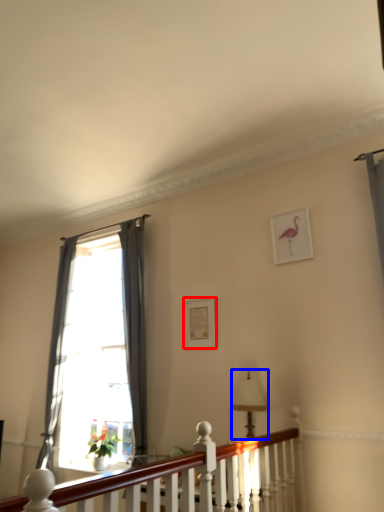
Question: Which object appears farthest to the camera in this image, picture frame (highlighted by a red box) or lamp (highlighted by a blue box)?

Choices:
 (A) picture frame
 (B) lamp

Answer: (A)